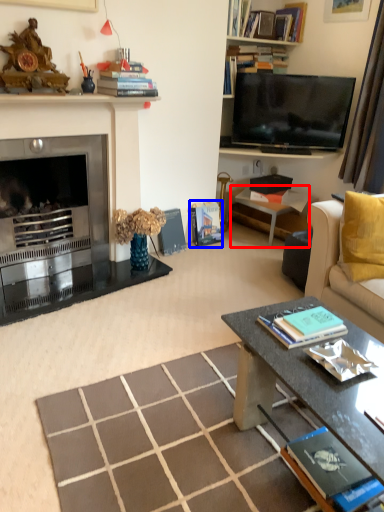
Question: Which of the following is the closest to the observer, side table (highlighted by a red box) or book (highlighted by a blue box)?

Choices:
 (A) side table
 (B) book

Answer: (A)